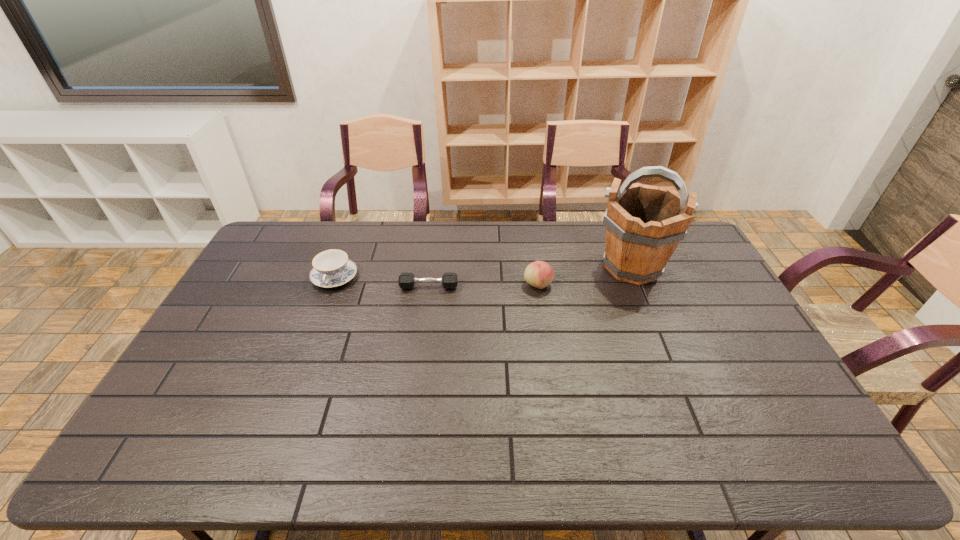
Locate an element on the screen. The height and width of the screenshot is (540, 960). free space that is in between the peach and the rightmost object is located at coordinates (585, 276).

This screenshot has width=960, height=540. What are the coordinates of `free space between the leftmost object and the rightmost object` in the screenshot? It's located at (483, 272).

What are the coordinates of `free space between the third object from right to left and the chinaware` in the screenshot? It's located at tap(382, 282).

Select which object appears as the closest to the dumbbell. Please provide its 2D coordinates. Your answer should be formatted as a tuple, i.e. [(x, y)], where the tuple contains the x and y coordinates of a point satisfying the conditions above.

[(332, 268)]

The image size is (960, 540). I want to click on object that can be found as the second closest to the peach, so click(x=406, y=280).

Where is `blank area in the image that satisfies the following two spatial constraints: 1. with the handle on the side of the second object from left to right; 2. on the right side of the chinaware`? The height and width of the screenshot is (540, 960). blank area in the image that satisfies the following two spatial constraints: 1. with the handle on the side of the second object from left to right; 2. on the right side of the chinaware is located at coordinates (331, 287).

At what (x,y) coordinates should I click in order to perform the action: click on vacant point that satisfies the following two spatial constraints: 1. with the handle on the side of the shortest object; 2. on the right side of the chinaware. Please return your answer as a coordinate pair (x, y). This screenshot has height=540, width=960. Looking at the image, I should click on (331, 287).

Identify the location of free space that satisfies the following two spatial constraints: 1. on the back side of the tallest object; 2. on the right side of the dumbbell. The height and width of the screenshot is (540, 960). (431, 267).

Locate an element on the screen. free space that satisfies the following two spatial constraints: 1. with the handle on the side of the leftmost object; 2. on the left side of the peach is located at coordinates (332, 285).

Image resolution: width=960 pixels, height=540 pixels. Identify the location of vacant space that satisfies the following two spatial constraints: 1. on the back side of the rightmost object; 2. on the right side of the peach. (536, 267).